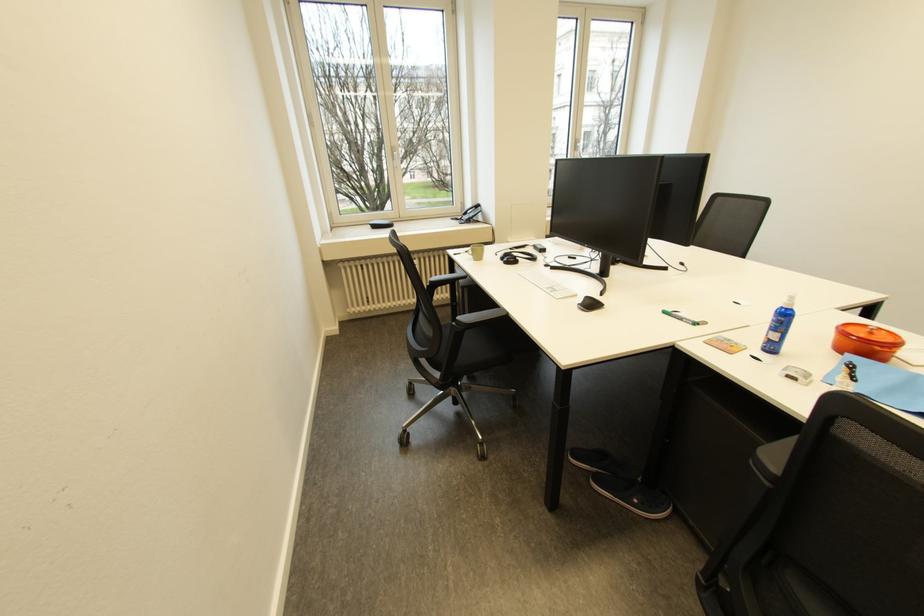
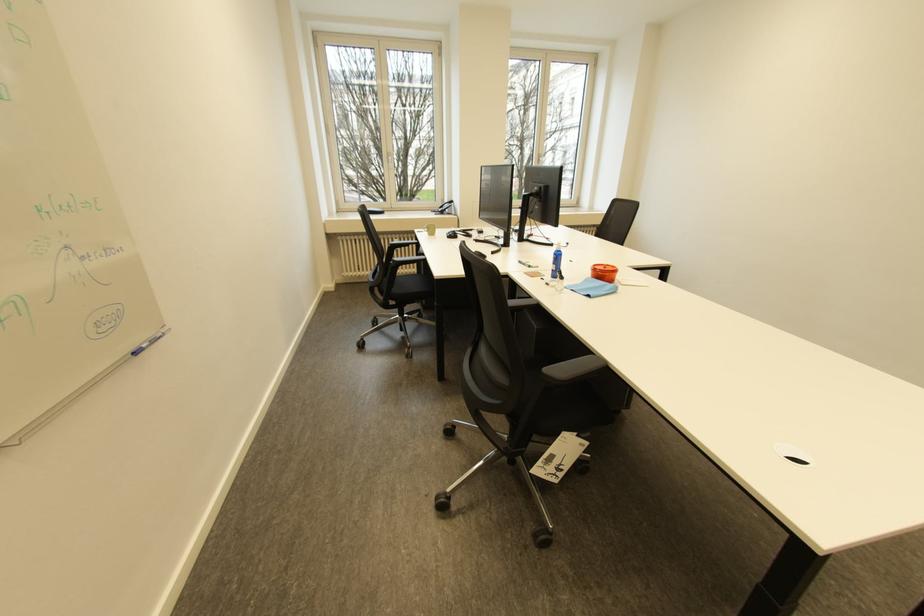
The point at [465,254] is marked in the first image. Where is the corresponding point in the second image?

(428, 233)